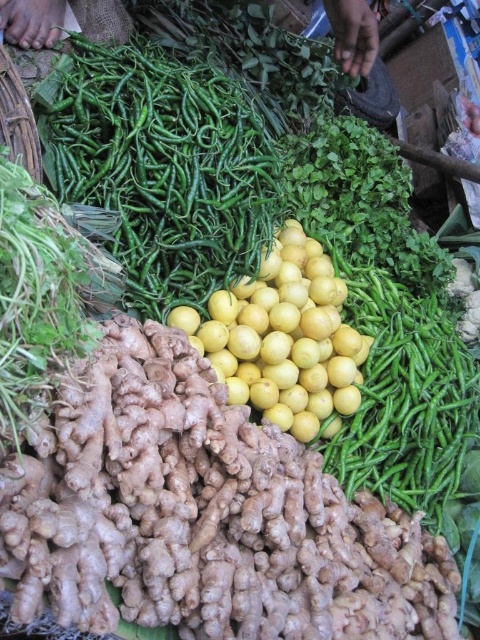
Can you confirm if green glossy chili peppers at upper center is smaller than yellow matte lemon at center?

Actually, green glossy chili peppers at upper center might be larger than yellow matte lemon at center.

Does green glossy chili peppers at upper center have a larger size compared to yellow matte lemon at center?

Yes.

Is point (243, 221) closer to viewer compared to point (240, 333)?

No, it is not.

Identify the location of green glossy chili peppers at upper center. [162, 166].